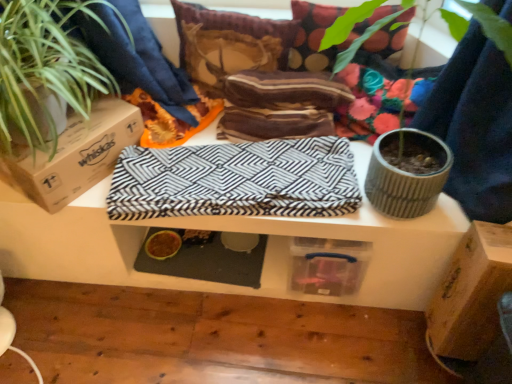
Find the location of a particular element. striped fabric pillow at upper center, acting as the first pillow starting from the left is located at coordinates (229, 43).

Locate an element on the screen. black and white zigzag fabric at center is located at coordinates (x=236, y=180).

This screenshot has width=512, height=384. What do you see at coordinates (323, 34) in the screenshot? I see `multicolored fabric pillow at upper center, arranged as the 2th pillow when viewed from the left` at bounding box center [323, 34].

Describe the element at coordinates (492, 27) in the screenshot. This screenshot has width=512, height=384. I see `green textured plant at upper right` at that location.

The width and height of the screenshot is (512, 384). In order to click on brown cardboard box at lower right, which is counted as the 2th cardboard box, starting from the left in this screenshot , I will do `click(471, 293)`.

Describe the element at coordinates (471, 293) in the screenshot. I see `brown cardboard box at lower right, which is counted as the 2th cardboard box, starting from the left` at that location.

The height and width of the screenshot is (384, 512). Identify the location of yellow rubber food bowl at lower center. [x=163, y=245].

Between brown cardboard box at left, marked as the 1th cardboard box in a top-to-bottom arrangement, and yellow rubber food bowl at lower center, which one appears on the right side from the viewer's perspective?

yellow rubber food bowl at lower center is more to the right.

Does point (40, 192) appear closer or farther from the camera than point (158, 238)?

Point (40, 192) is positioned closer to the camera compared to point (158, 238).

Is black and white zigzag fabric at center situated inside green textured plant at upper right or outside?

black and white zigzag fabric at center is spatially situated outside green textured plant at upper right.

Can you tell me how much black and white zigzag fabric at center and green textured plant at upper right differ in facing direction?

The facing directions of black and white zigzag fabric at center and green textured plant at upper right are 5.03 degrees apart.

Where is `blanket lying behind the green textured plant at upper right`? blanket lying behind the green textured plant at upper right is located at coordinates (236, 180).

How distant is black and white zigzag fabric at center from green textured plant at upper right?

19.27 inches.

In terms of width, does black and white zigzag fabric at center look wider or thinner when compared to multicolored fabric pillow at upper center, arranged as the first pillow when viewed from the right?

Considering their sizes, black and white zigzag fabric at center looks broader than multicolored fabric pillow at upper center, arranged as the first pillow when viewed from the right.

Is black and white zigzag fabric at center far from multicolored fabric pillow at upper center, arranged as the first pillow when viewed from the right?

No, black and white zigzag fabric at center is in close proximity to multicolored fabric pillow at upper center, arranged as the first pillow when viewed from the right.

Is multicolored fabric pillow at upper center, arranged as the 2th pillow when viewed from the left, located within black and white zigzag fabric at center?

No.

Does black and white zigzag fabric at center turn towards multicolored fabric pillow at upper center, arranged as the first pillow when viewed from the right?

No, black and white zigzag fabric at center does not turn towards multicolored fabric pillow at upper center, arranged as the first pillow when viewed from the right.

Between yellow rubber food bowl at lower center and black and white zigzag fabric at center, which one has larger size?

Bigger between the two is black and white zigzag fabric at center.

Is yellow rubber food bowl at lower center shorter than black and white zigzag fabric at center?

Yes, yellow rubber food bowl at lower center is shorter than black and white zigzag fabric at center.

Does yellow rubber food bowl at lower center have a lesser width compared to black and white zigzag fabric at center?

Indeed, yellow rubber food bowl at lower center has a lesser width compared to black and white zigzag fabric at center.

Does yellow rubber food bowl at lower center appear on the right side of black and white zigzag fabric at center?

Incorrect, yellow rubber food bowl at lower center is not on the right side of black and white zigzag fabric at center.

Does green leafy plant at left have a lesser height compared to yellow rubber food bowl at lower center?

No, green leafy plant at left is not shorter than yellow rubber food bowl at lower center.

Find the location of `houseplant above the yellow rubber food bowl at lower center (from a real-world perspective)`. houseplant above the yellow rubber food bowl at lower center (from a real-world perspective) is located at coordinates (46, 66).

Is green leafy plant at left inside the boundaries of yellow rubber food bowl at lower center, or outside?

green leafy plant at left is not inside yellow rubber food bowl at lower center, it's outside.

How many degrees apart are the facing directions of green leafy plant at left and yellow rubber food bowl at lower center?

green leafy plant at left and yellow rubber food bowl at lower center are facing 1.71 degrees away from each other.

Considering the relative positions of yellow rubber food bowl at lower center and brown cardboard box at lower right, acting as the second cardboard box starting from the top, in the image provided, is yellow rubber food bowl at lower center to the left of brown cardboard box at lower right, acting as the second cardboard box starting from the top, from the viewer's perspective?

Correct, you'll find yellow rubber food bowl at lower center to the left of brown cardboard box at lower right, acting as the second cardboard box starting from the top.

Can you confirm if yellow rubber food bowl at lower center is wider than brown cardboard box at lower right, which is the first cardboard box from right to left?

Incorrect, the width of yellow rubber food bowl at lower center does not surpass that of brown cardboard box at lower right, which is the first cardboard box from right to left.

Can you confirm if yellow rubber food bowl at lower center is taller than brown cardboard box at lower right, which is the first cardboard box from right to left?

No.

Who is bigger, yellow rubber food bowl at lower center or brown cardboard box at lower right, which is counted as the 2th cardboard box, starting from the left?

Bigger between the two is brown cardboard box at lower right, which is counted as the 2th cardboard box, starting from the left.

In terms of height, does brown cardboard box at lower right, which appears as the 1th cardboard box when ordered from the bottom, look taller or shorter compared to brown cardboard box at left, the 2th cardboard box from the right?

Clearly, brown cardboard box at lower right, which appears as the 1th cardboard box when ordered from the bottom, is taller compared to brown cardboard box at left, the 2th cardboard box from the right.

Looking at this image, is brown cardboard box at lower right, which appears as the 1th cardboard box when ordered from the bottom, far away from brown cardboard box at left, the 2th cardboard box from the right?

Absolutely, brown cardboard box at lower right, which appears as the 1th cardboard box when ordered from the bottom, is distant from brown cardboard box at left, the 2th cardboard box from the right.

Could you tell me if brown cardboard box at lower right, which is the first cardboard box from right to left, is facing brown cardboard box at left, which is the first cardboard box from left to right?

Yes, brown cardboard box at lower right, which is the first cardboard box from right to left, is aimed at brown cardboard box at left, which is the first cardboard box from left to right.

Where is `cardboard box in front of the brown cardboard box at left, the second cardboard box ordered from the bottom`? This screenshot has width=512, height=384. cardboard box in front of the brown cardboard box at left, the second cardboard box ordered from the bottom is located at coordinates (471, 293).

Where is `food below the brown cardboard box at left, the 2th cardboard box from the right (from the image's perspective)`? The width and height of the screenshot is (512, 384). food below the brown cardboard box at left, the 2th cardboard box from the right (from the image's perspective) is located at coordinates [x=163, y=245].

Where is `vegetation that appears above the black and white zigzag fabric at center (from a real-world perspective)`? vegetation that appears above the black and white zigzag fabric at center (from a real-world perspective) is located at coordinates (492, 27).

Considering their positions, is striped fabric pillow at upper center, acting as the first pillow starting from the left, positioned further to multicolored fabric pillow at upper center, arranged as the first pillow when viewed from the right, than yellow rubber food bowl at lower center?

yellow rubber food bowl at lower center is positioned further to the anchor multicolored fabric pillow at upper center, arranged as the first pillow when viewed from the right.

Based on their spatial positions, is brown cardboard box at left, which is the first cardboard box from left to right, or striped fabric pillow at upper center, placed as the second pillow when sorted from right to left, further from multicolored fabric pillow at upper center, arranged as the 2th pillow when viewed from the left?

Among the two, brown cardboard box at left, which is the first cardboard box from left to right, is located further to multicolored fabric pillow at upper center, arranged as the 2th pillow when viewed from the left.

Which object lies further to the anchor point brown cardboard box at left, the second cardboard box ordered from the bottom, black and white zigzag fabric at center or multicolored fabric pillow at upper center, arranged as the 2th pillow when viewed from the left?

Based on the image, multicolored fabric pillow at upper center, arranged as the 2th pillow when viewed from the left, appears to be further to brown cardboard box at left, the second cardboard box ordered from the bottom.

Based on the photo, estimate the real-world distances between objects in this image. Which object is closer to green textured plant at upper right, black and white zigzag fabric at center or green leafy plant at left?

Based on the image, black and white zigzag fabric at center appears to be nearer to green textured plant at upper right.

From the image, which object appears to be farther from green leafy plant at left, brown cardboard box at lower right, which is counted as the 2th cardboard box, starting from the left, or multicolored fabric pillow at upper center, arranged as the 2th pillow when viewed from the left?

The object further to green leafy plant at left is brown cardboard box at lower right, which is counted as the 2th cardboard box, starting from the left.

From the image, which object appears to be nearer to striped fabric pillow at upper center, placed as the second pillow when sorted from right to left, green textured plant at upper right or yellow rubber food bowl at lower center?

green textured plant at upper right is positioned closer to the anchor striped fabric pillow at upper center, placed as the second pillow when sorted from right to left.

From the image, which object appears to be farther from striped fabric pillow at upper center, acting as the first pillow starting from the left, yellow rubber food bowl at lower center or green textured plant at upper right?

yellow rubber food bowl at lower center is positioned further to the anchor striped fabric pillow at upper center, acting as the first pillow starting from the left.

Which object lies nearer to the anchor point brown cardboard box at lower right, acting as the second cardboard box starting from the top, brown cardboard box at left, the second cardboard box ordered from the bottom, or yellow rubber food bowl at lower center?

yellow rubber food bowl at lower center.

The image size is (512, 384). I want to click on blanket located between green leafy plant at left and yellow rubber food bowl at lower center in the depth direction, so click(x=236, y=180).

I want to click on cardboard box between green leafy plant at left and multicolored fabric pillow at upper center, arranged as the first pillow when viewed from the right, from left to right, so click(76, 155).

Locate an element on the screen. The height and width of the screenshot is (384, 512). blanket between brown cardboard box at left, the 2th cardboard box from the right, and brown cardboard box at lower right, which appears as the 1th cardboard box when ordered from the bottom, in the horizontal direction is located at coordinates (236, 180).

Where is `blanket located between green leafy plant at left and green textured plant at upper right in the left-right direction`? blanket located between green leafy plant at left and green textured plant at upper right in the left-right direction is located at coordinates (236, 180).